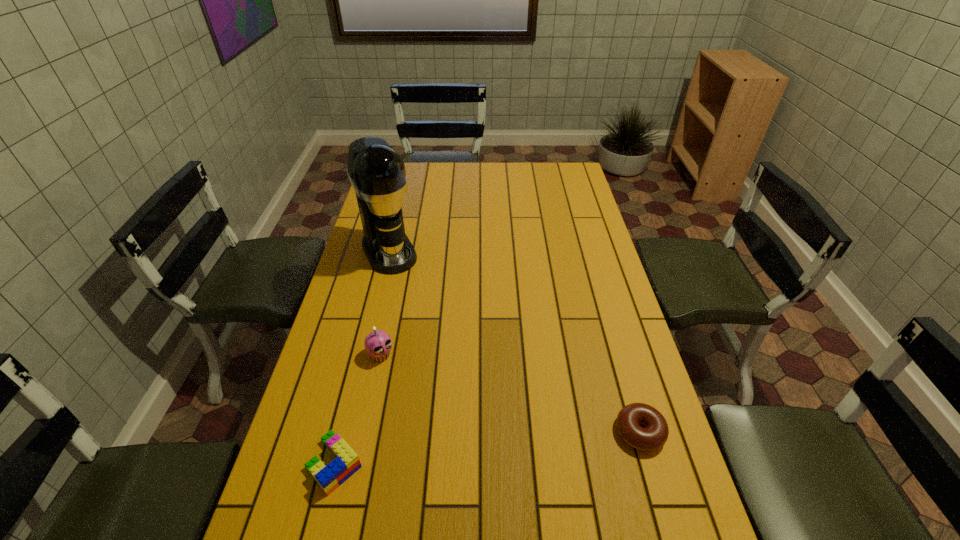
I want to click on Lego, so click(x=346, y=463).

Where is `doughnut`? The height and width of the screenshot is (540, 960). doughnut is located at coordinates (655, 434).

Identify the location of the farthest object. This screenshot has width=960, height=540. (377, 173).

I want to click on coffee maker, so click(x=377, y=173).

Locate an element on the screen. The height and width of the screenshot is (540, 960). cupcake is located at coordinates (378, 344).

Locate an element on the screen. The height and width of the screenshot is (540, 960). the third shortest object is located at coordinates click(378, 344).

Where is `blank space located on the right of the Lego`? The height and width of the screenshot is (540, 960). blank space located on the right of the Lego is located at coordinates (492, 463).

I want to click on vacant point located on the left of the rightmost object, so click(x=525, y=432).

Identify the location of blank space located place cup under the spout of the tallest object. Image resolution: width=960 pixels, height=540 pixels. (403, 283).

Locate an element on the screen. The height and width of the screenshot is (540, 960). free point located 0.310m place cup under the spout of the tallest object is located at coordinates (431, 334).